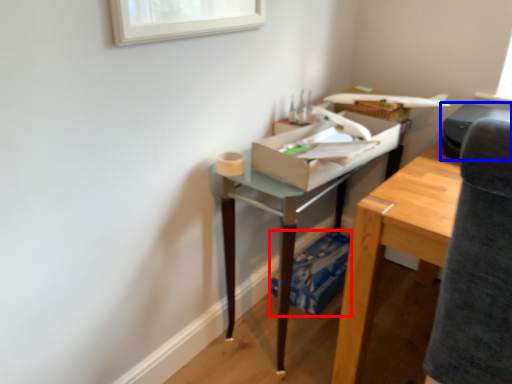
Question: Which object is further to the camera taking this photo, cardboard box (highlighted by a red box) or printer (highlighted by a blue box)?

Choices:
 (A) cardboard box
 (B) printer

Answer: (A)